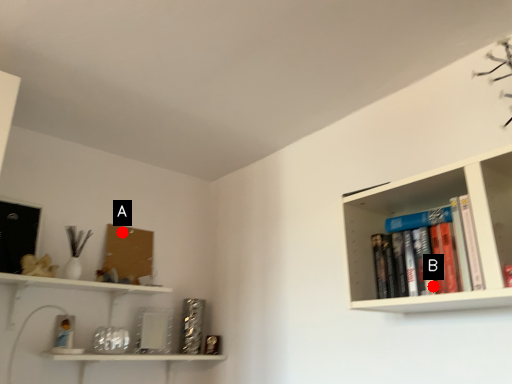
Question: Two points are circled on the image, labeled by A and B beside each circle. Which point appears farthest from the camera in this image?

Choices:
 (A) A is further
 (B) B is further

Answer: (A)